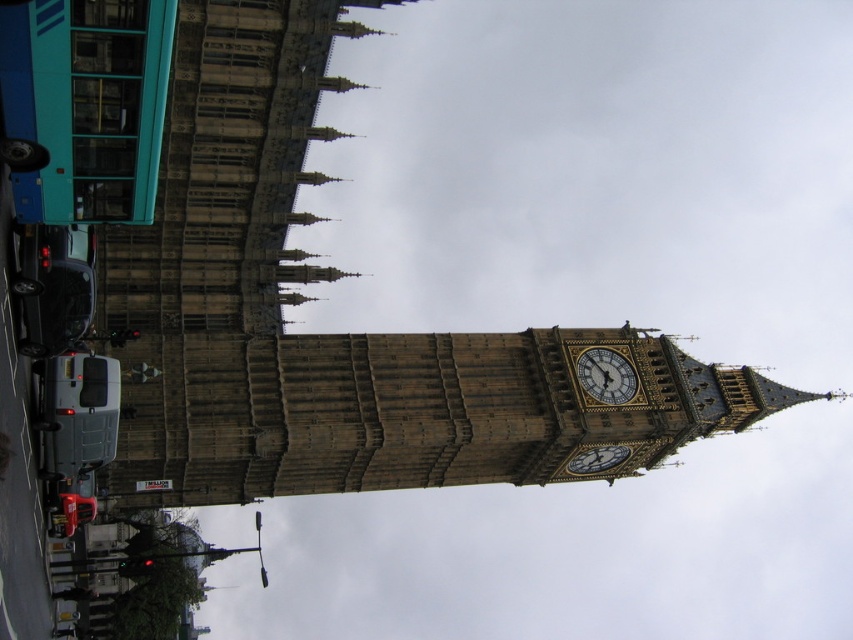
You are standing in front of the Elizabeth Tower and want to take a photo of the clock face. There are two points marked on the ground at coordinates point (614, 374) and point (595, 451). Which point should you stand on to ensure the clock face is fully visible without any obstruction from the vehicles parked on the street?

You should stand on point (614, 374) because it is in front of point (595, 451), meaning it is closer to the tower and less likely to be obstructed by the vehicles parked on the street.

You are a tourist visiting London and want to take a photo of the polished brass clock at center and the gold ornate clock at center. Which clock should you zoom in on to capture more details in your photo?

The polished brass clock at center is smaller than the gold ornate clock at center, so you should zoom in on the polished brass clock at center to capture more details.